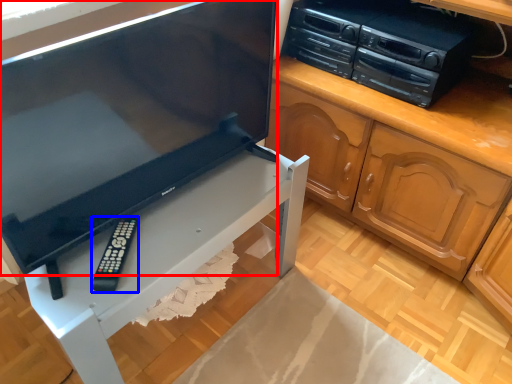
Question: Which point is further to the camera, television (highlighted by a red box) or remote (highlighted by a blue box)?

Choices:
 (A) television
 (B) remote

Answer: (B)